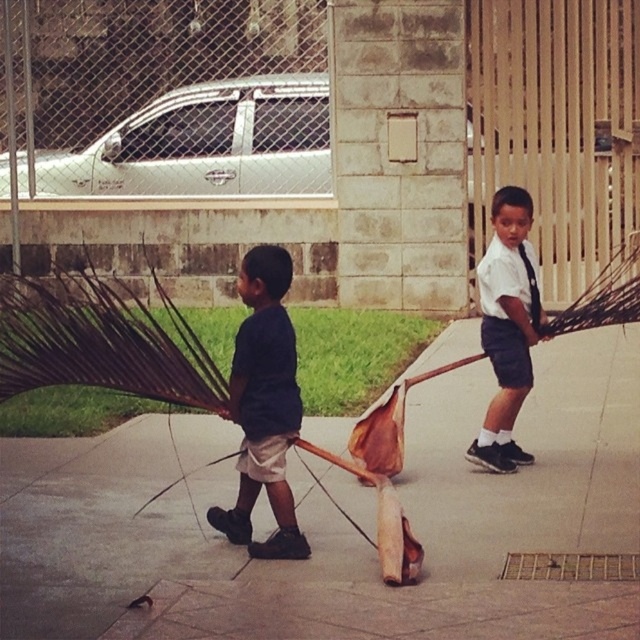
Question: Can you confirm if brown concrete pavement at center is smaller than dark blue shirt at center?

Choices:
 (A) no
 (B) yes

Answer: (B)

Question: Which of the following is the farthest from the observer?

Choices:
 (A) white shirt at center
 (B) dark blue shirt at center

Answer: (A)

Question: Can you confirm if brown concrete pavement at center is thinner than white shirt at center?

Choices:
 (A) no
 (B) yes

Answer: (A)

Question: Considering the real-world distances, which object is closest to the white shirt at center?

Choices:
 (A) brown concrete pavement at center
 (B) dark blue shirt at center

Answer: (B)

Question: Can you confirm if brown concrete pavement at center is positioned above white shirt at center?

Choices:
 (A) yes
 (B) no

Answer: (B)

Question: Which point is closer to the camera?

Choices:
 (A) (502, 292)
 (B) (282, 461)

Answer: (B)